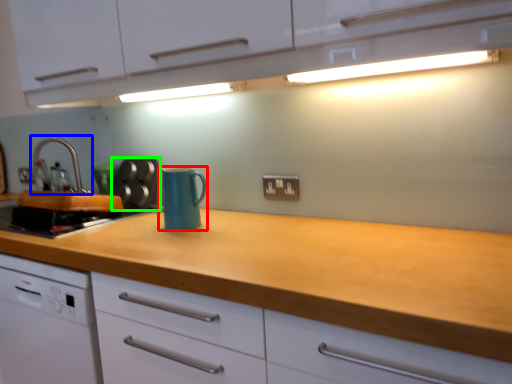
Question: Estimate the real-world distances between objects in this image. Which object is closer to kitchen appliance (highlighted by a red box), tap (highlighted by a blue box) or appliance (highlighted by a green box)?

Choices:
 (A) tap
 (B) appliance

Answer: (B)